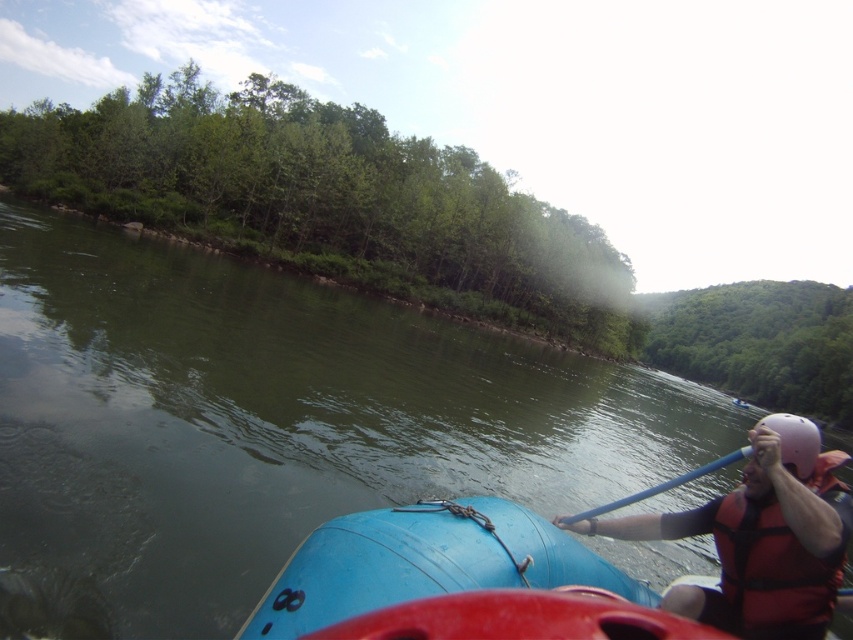
Question: Can you confirm if red life vest at right is positioned above peach matte helmet at right?

Choices:
 (A) yes
 (B) no

Answer: (B)

Question: Considering the real-world distances, which object is closest to the green leafy hillside at upper right?

Choices:
 (A) red/black life jacket at right
 (B) green leafy trees at upper left
 (C) blue rubber boat at center

Answer: (B)

Question: Is green leafy trees at upper left above blue plastic paddle at center?

Choices:
 (A) no
 (B) yes

Answer: (B)

Question: Is peach matte helmet at right closer to the viewer compared to blue plastic paddle at center?

Choices:
 (A) yes
 (B) no

Answer: (A)

Question: Considering the real-world distances, which object is closest to the green leafy hillside at upper right?

Choices:
 (A) red life vest at right
 (B) green leafy trees at upper left

Answer: (B)

Question: Which object is the closest to the blue plastic paddle at center?

Choices:
 (A) green leafy hillside at upper right
 (B) green leafy trees at upper left

Answer: (B)